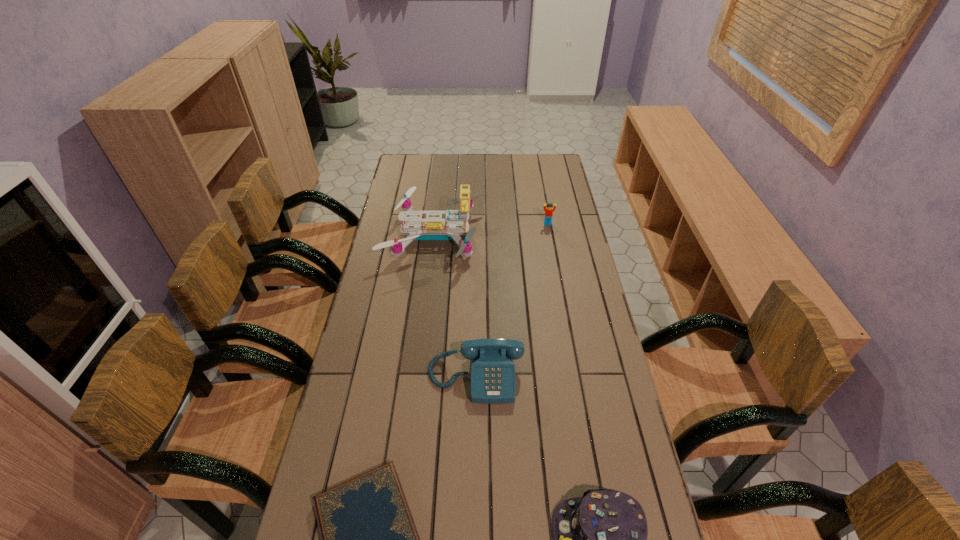
Locate an element on the screen. This screenshot has width=960, height=540. free space at the far left corner is located at coordinates (420, 168).

Locate an element on the screen. This screenshot has width=960, height=540. vacant region at the far right corner of the desktop is located at coordinates (560, 167).

Identify the location of free space that is in between the drone and the third farthest object. Image resolution: width=960 pixels, height=540 pixels. (456, 306).

Where is `free space between the Lego and the drone`? Image resolution: width=960 pixels, height=540 pixels. free space between the Lego and the drone is located at coordinates (492, 230).

I want to click on vacant region between the Lego and the third farthest object, so click(512, 300).

Image resolution: width=960 pixels, height=540 pixels. Find the location of `vacant area between the tallest object and the Lego`. vacant area between the tallest object and the Lego is located at coordinates (492, 230).

Identify which object is the fourth nearest to the telephone. Please provide its 2D coordinates. Your answer should be formatted as a tuple, i.e. [(x, y)], where the tuple contains the x and y coordinates of a point satisfying the conditions above.

[(549, 210)]

The height and width of the screenshot is (540, 960). I want to click on object that is the second closest to the paperback book, so click(x=600, y=539).

Image resolution: width=960 pixels, height=540 pixels. I want to click on vacant area in the image that satisfies the following two spatial constraints: 1. on the face of the Lego; 2. on the front-facing side of the tallest object, so click(550, 236).

At what (x,y) coordinates should I click in order to perform the action: click on free spot that satisfies the following two spatial constraints: 1. on the face of the Lego; 2. on the front-facing side of the drone. Please return your answer as a coordinate pair (x, y). Looking at the image, I should click on (550, 236).